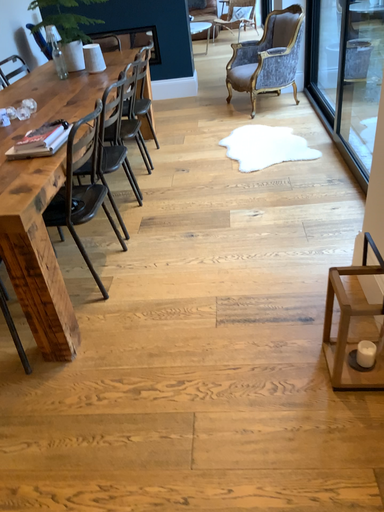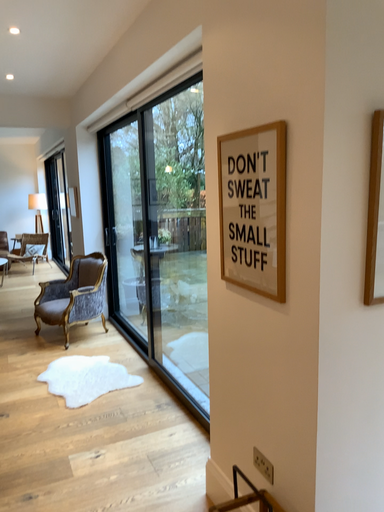
Question: How did the camera likely rotate when shooting the video?

Choices:
 (A) rotated downward
 (B) rotated upward

Answer: (B)